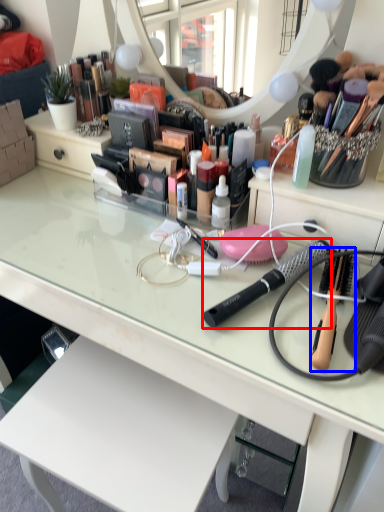
Question: Which object is closer to the camera taking this photo, brush (highlighted by a red box) or brush (highlighted by a blue box)?

Choices:
 (A) brush
 (B) brush

Answer: (B)